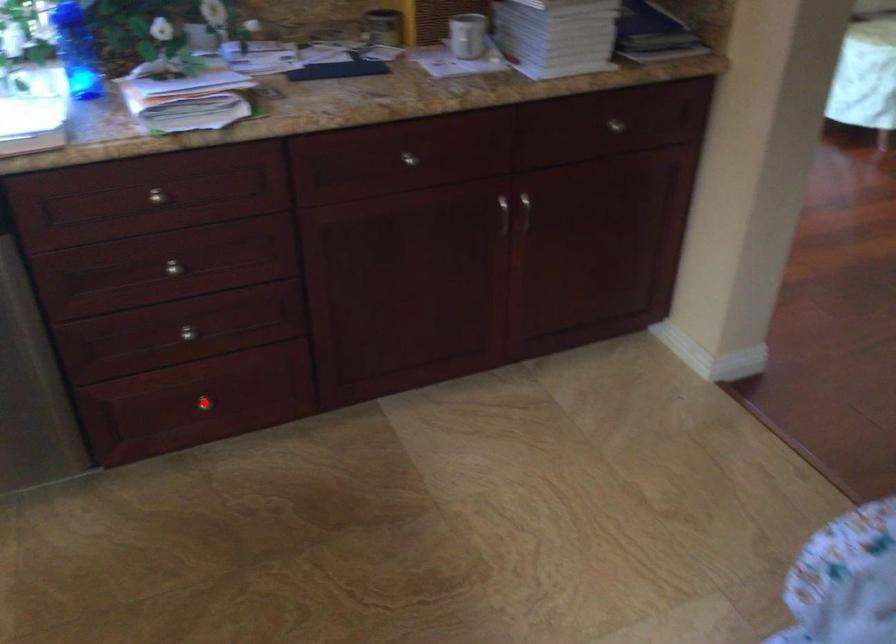
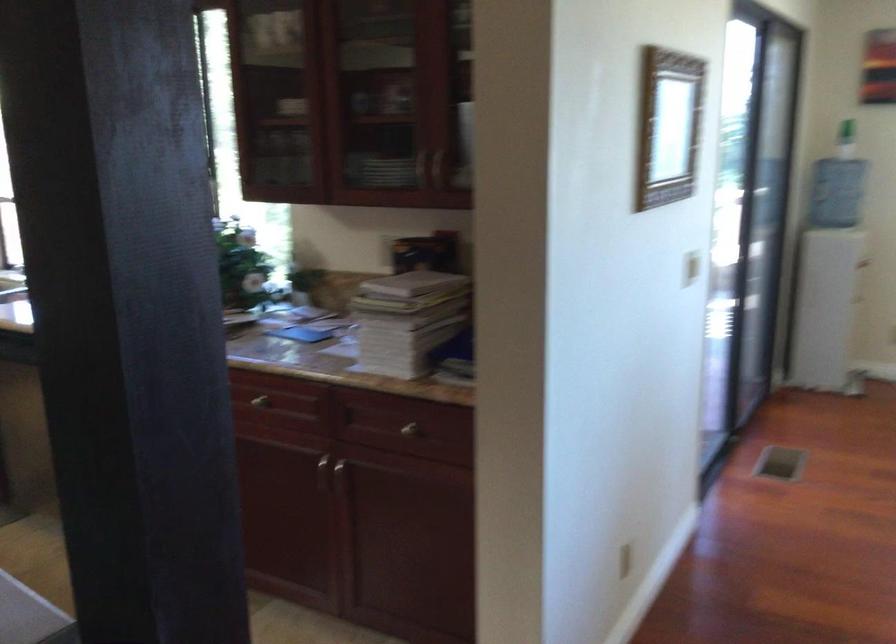
Question: I am providing you with two images of the same scene from different viewpoints. A red point is marked on the first image. At the location where the point appears in image 1, is it still visible in image 2?

Choices:
 (A) Yes
 (B) No

Answer: (B)